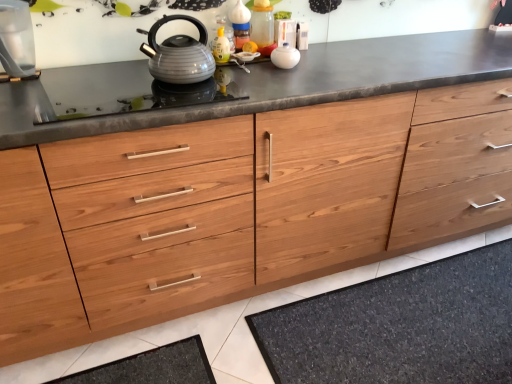
Question: Looking at their shapes, would you say black glass gas stove at center is wider or thinner than dark gray textured bath mat at lower center?

Choices:
 (A) wide
 (B) thin

Answer: (B)

Question: Choose the correct answer: Is black glass gas stove at center inside dark gray textured bath mat at lower center or outside it?

Choices:
 (A) outside
 (B) inside

Answer: (A)

Question: Estimate the real-world distances between objects in this image. Which object is closer to the dark gray textured bath mat at lower center?

Choices:
 (A) black glass gas stove at center
 (B) matte gray kettle at center
 (C) white glossy bowl at upper center, the second appliance in the left-to-right sequence
 (D) transparent glass water at left, the second appliance in the right-to-left sequence

Answer: (A)

Question: Which object is the farthest from the transparent glass water at left, the second appliance in the right-to-left sequence?

Choices:
 (A) black glass gas stove at center
 (B) dark gray textured bath mat at lower center
 (C) white glossy bowl at upper center, which is counted as the first appliance, starting from the right
 (D) matte gray kettle at center

Answer: (B)